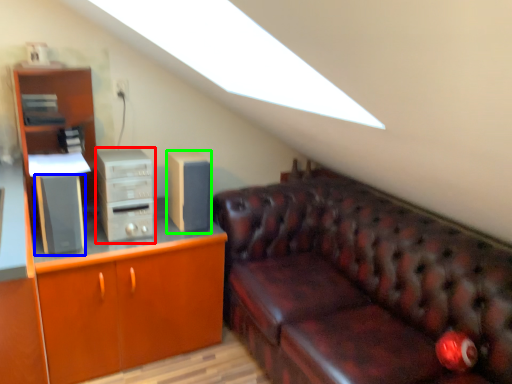
Question: Estimate the real-world distances between objects in this image. Which object is farther from computer tower (highlighted by a red box), speaker (highlighted by a blue box) or speaker (highlighted by a green box)?

Choices:
 (A) speaker
 (B) speaker

Answer: (B)